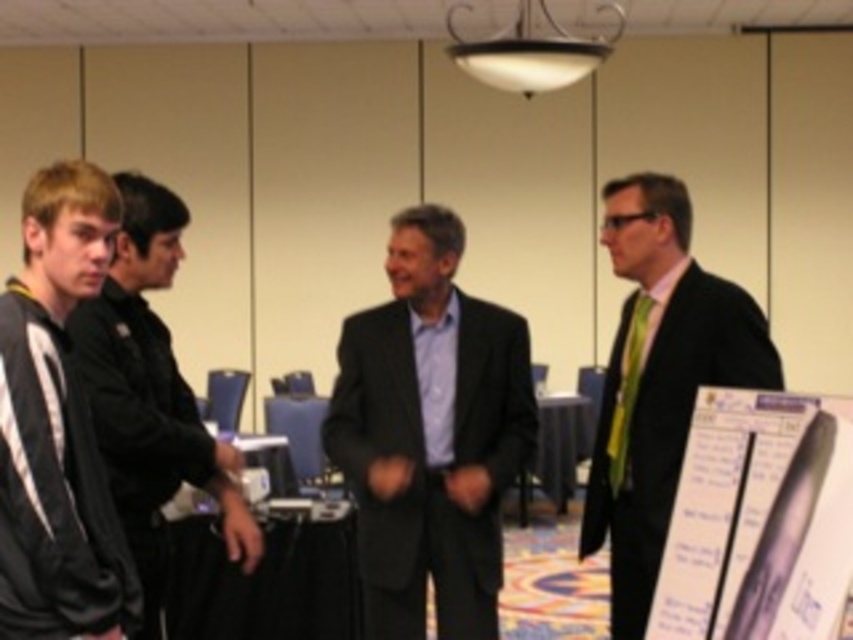
Is white paper at lower right shorter than matte black suit at right?

Indeed, white paper at lower right has a lesser height compared to matte black suit at right.

Measure the distance between white paper at lower right and camera.

They are 5.95 feet apart.

Locate an element on the screen. white paper at lower right is located at coordinates (757, 518).

Which of these two, black fleece jacket at left or black jacket at left, stands taller?

black jacket at left is taller.

Describe the element at coordinates (57, 426) in the screenshot. The width and height of the screenshot is (853, 640). I see `black fleece jacket at left` at that location.

I want to click on black fleece jacket at left, so click(57, 426).

Who is taller, black fleece jacket at left or white paper at lower right?

Standing taller between the two is black fleece jacket at left.

Which is behind, point (16, 289) or point (785, 502)?

Point (16, 289)

Where is `black fleece jacket at left`? The image size is (853, 640). black fleece jacket at left is located at coordinates (57, 426).